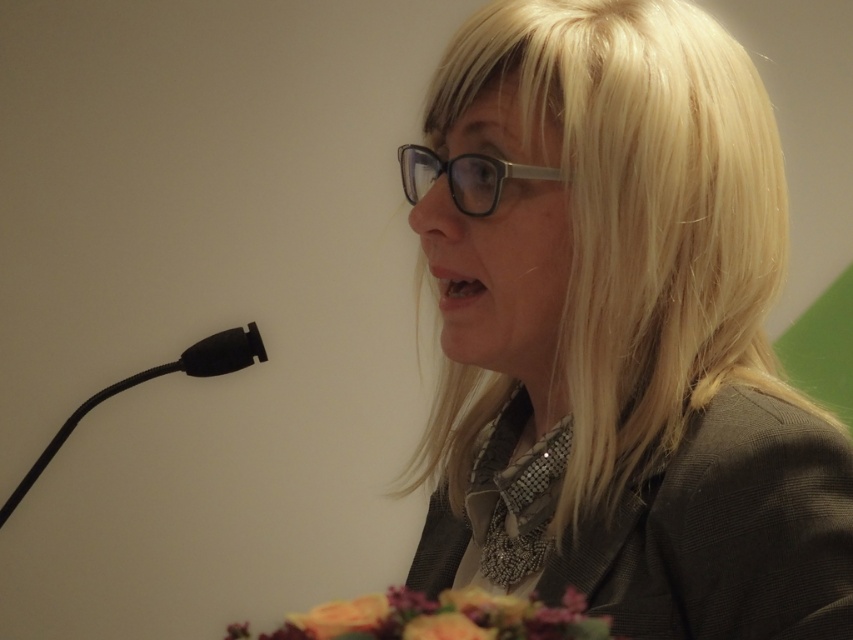
Question: Does floral bouquet at lower center appear over black matte microphone at left?

Choices:
 (A) yes
 (B) no

Answer: (B)

Question: Does blonde silky hair at center appear under black matte microphone at left?

Choices:
 (A) no
 (B) yes

Answer: (A)

Question: Which point appears closest to the camera in this image?

Choices:
 (A) (584, 106)
 (B) (10, 512)

Answer: (A)

Question: From the image, what is the correct spatial relationship of floral bouquet at lower center in relation to black matte microphone at left?

Choices:
 (A) below
 (B) above

Answer: (A)

Question: Which of the following is the farthest from the observer?

Choices:
 (A) black matte microphone at lower left
 (B) floral bouquet at lower center

Answer: (A)

Question: Which point is closer to the camera?

Choices:
 (A) black matte microphone at lower left
 (B) floral bouquet at lower center
 (C) blonde silky hair at center

Answer: (B)